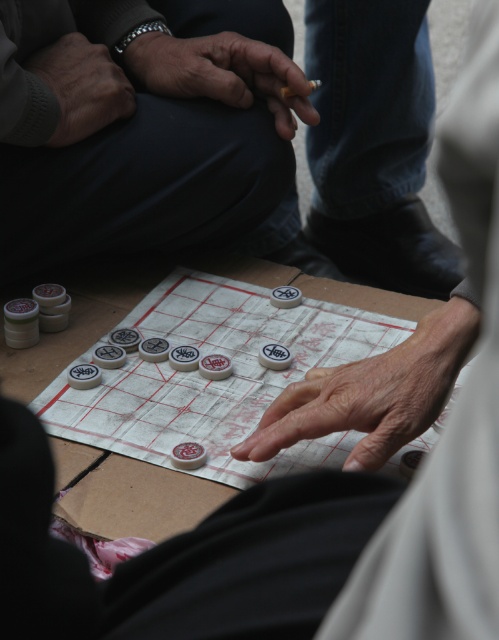
Who is shorter, white glossy checkers at center or matte black hand at upper center?

Standing shorter between the two is matte black hand at upper center.

Is white glossy checkers at center shorter than matte black hand at upper center?

No, white glossy checkers at center is not shorter than matte black hand at upper center.

This screenshot has width=499, height=640. Describe the element at coordinates (215, 380) in the screenshot. I see `white glossy checkers at center` at that location.

I want to click on white glossy checkers at center, so click(215, 380).

Which is below, white glossy checkers at center or gray knit sweater at upper left?

Positioned lower is white glossy checkers at center.

Can you confirm if white glossy checkers at center is wider than gray knit sweater at upper left?

Correct, the width of white glossy checkers at center exceeds that of gray knit sweater at upper left.

Image resolution: width=499 pixels, height=640 pixels. I want to click on white glossy checkers at center, so click(215, 380).

Does matte black hand at upper center appear over smooth brown cigarette at center?

Correct, matte black hand at upper center is located above smooth brown cigarette at center.

Does matte black hand at upper center appear on the left side of smooth brown cigarette at center?

Correct, you'll find matte black hand at upper center to the left of smooth brown cigarette at center.

Does point (183, 90) come farther from viewer compared to point (292, 92)?

Yes, it is behind point (292, 92).

Where is `matte black hand at upper center`? matte black hand at upper center is located at coordinates (222, 74).